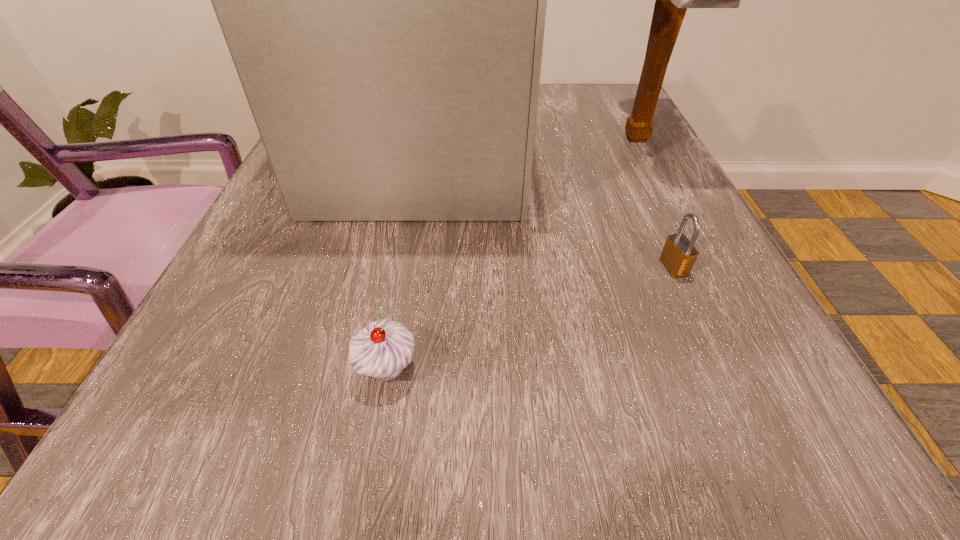
Image resolution: width=960 pixels, height=540 pixels. In the image, there is a desktop. Find the location of `vacant space at the right edge`. vacant space at the right edge is located at coordinates pyautogui.click(x=618, y=186).

At what (x,y) coordinates should I click in order to perform the action: click on vacant space at the near left corner. Please return your answer as a coordinate pair (x, y). Image resolution: width=960 pixels, height=540 pixels. Looking at the image, I should click on (216, 433).

In the image, there is a desktop. Where is `vacant space at the far right corner`? Image resolution: width=960 pixels, height=540 pixels. vacant space at the far right corner is located at coordinates 588,122.

This screenshot has width=960, height=540. Identify the location of vacant space at the near right corner. (716, 452).

Where is `vacant space in between the shortest object and the toaster oven`? vacant space in between the shortest object and the toaster oven is located at coordinates (551, 210).

Locate an element on the screen. The image size is (960, 540). vacant point located between the toaster oven and the shortest object is located at coordinates (551, 210).

The height and width of the screenshot is (540, 960). What are the coordinates of `empty space between the second shortest object and the toaster oven` in the screenshot? It's located at (x=408, y=261).

The width and height of the screenshot is (960, 540). What are the coordinates of `free spot between the cupcake and the toaster oven` in the screenshot? It's located at (408, 261).

Where is `free space that is in between the third farthest object and the toaster oven`? This screenshot has width=960, height=540. free space that is in between the third farthest object and the toaster oven is located at coordinates (551, 210).

Image resolution: width=960 pixels, height=540 pixels. In order to click on vacant area that lies between the padlock and the cupcake in this screenshot , I will do `click(531, 318)`.